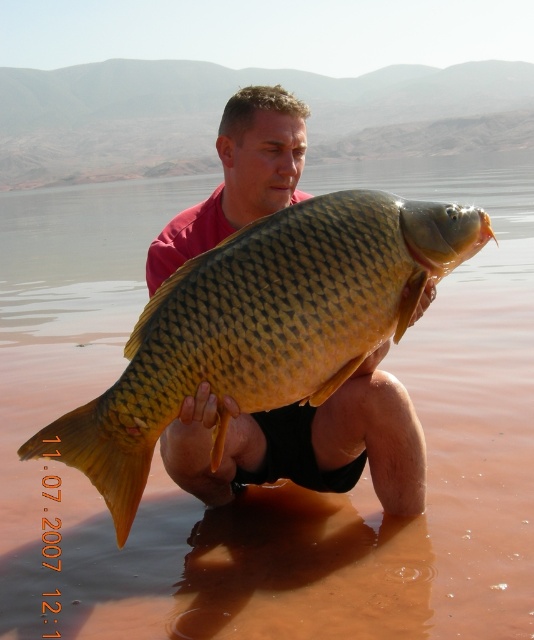
You are a photographer trying to capture the golden scaly fish at center and the matte yellow fish at center in a single shot. Which fish should you focus on first if you want to ensure both are in focus?

The golden scaly fish at center is located above the matte yellow fish at center, so you should focus on the matte yellow fish at center first since it is closer to the camera.

You are a photographer trying to capture the golden scaly fish at center and the matte yellow fish at center in a single frame. Since both are at the center, which one is positioned to the left?

The golden scaly fish at center is to the left of the matte yellow fish at center.

You are standing at the origin point in the image. You want to move towards the point labeled point (451, 250). Will you pass by the point labeled point (365, 417) on your way?

Yes, because point (451, 250) is in front of point (365, 417), so moving towards the first point would require passing the second point.